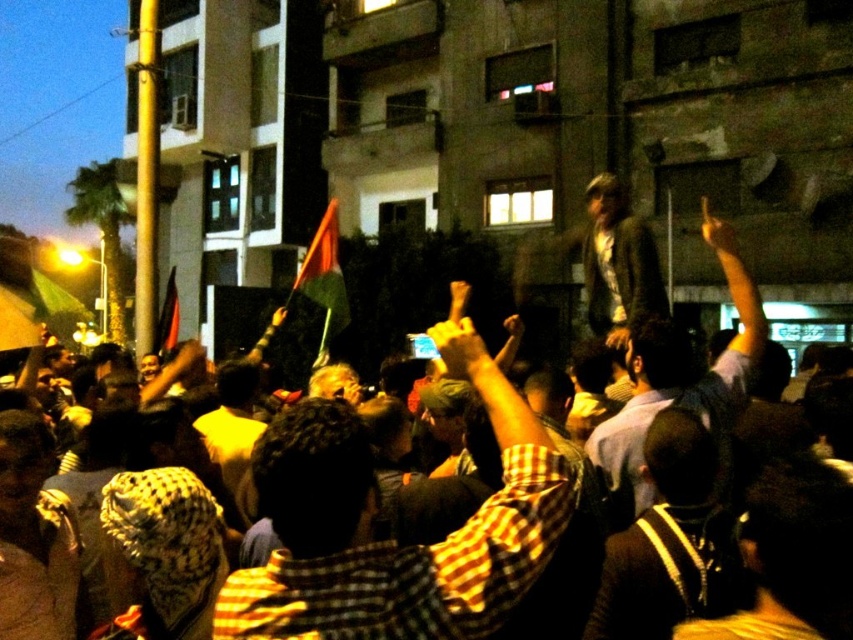
You are a photographer trying to capture the crowd in the image. You notice the checkered shirt at center and the dark brown leather jacket at center. Which one should you focus on if you want to photograph the person standing higher in the crowd?

The checkered shirt at center is above the dark brown leather jacket at center, so focusing on the checkered shirt at center would capture the person standing higher in the crowd.

You are standing in the crowd at the nighttime gathering. You need to locate the dark gray jacket at upper center quickly. Based on the scene description, where should you look relative to the buildings in the background?

The dark gray jacket at upper center is located at point 0.586 along the horizontal axis and 0.800 along the vertical axis, meaning it is positioned towards the right side and near the top of the image, relative to the buildings in the background.